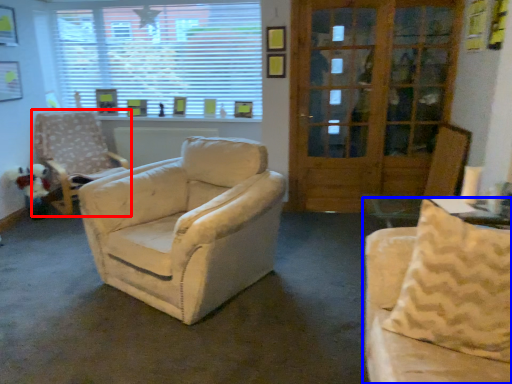
Question: Which object appears farthest to the camera in this image, chair (highlighted by a red box) or studio couch (highlighted by a blue box)?

Choices:
 (A) chair
 (B) studio couch

Answer: (A)